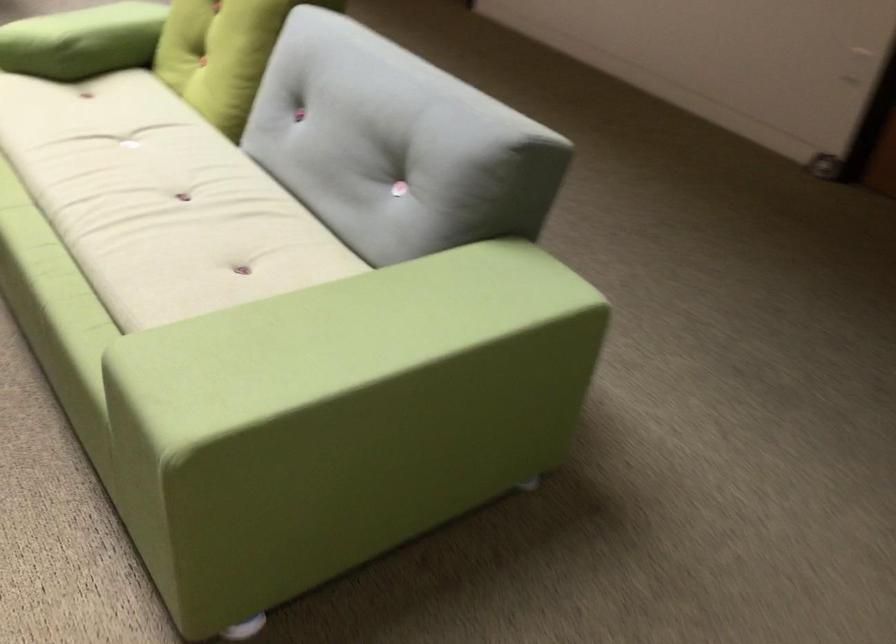
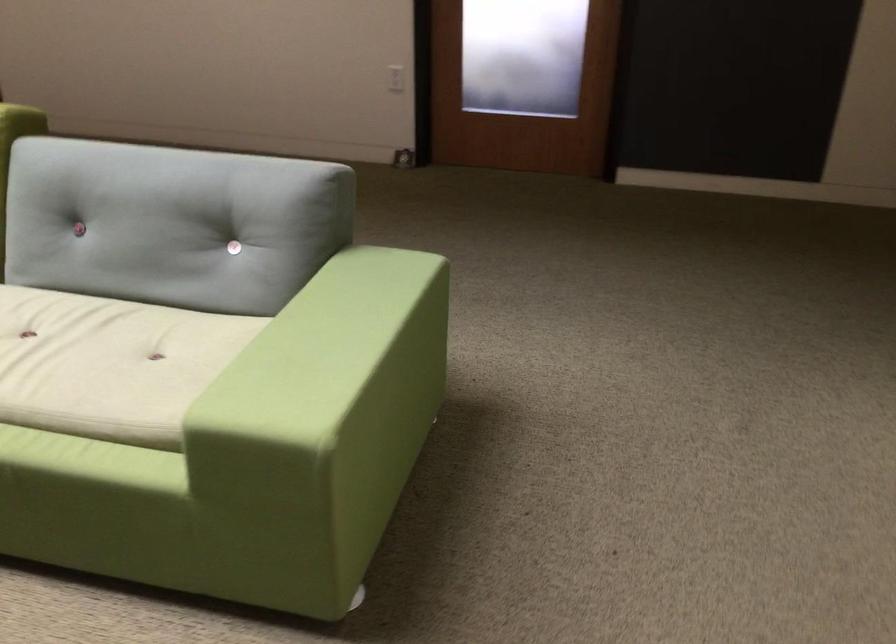
Where in the second image is the point corresponding to point 324,343 from the first image?

(323, 353)